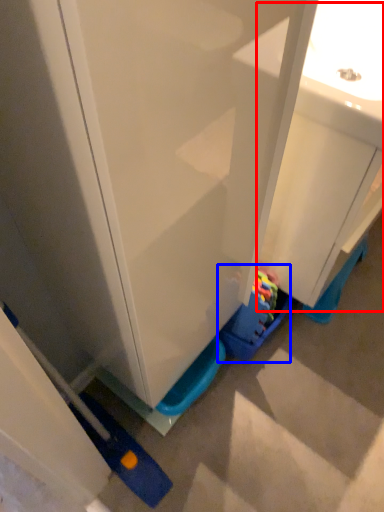
Question: Which of the following is the farthest to the observer, sink (highlighted by a red box) or toy (highlighted by a blue box)?

Choices:
 (A) sink
 (B) toy

Answer: (B)